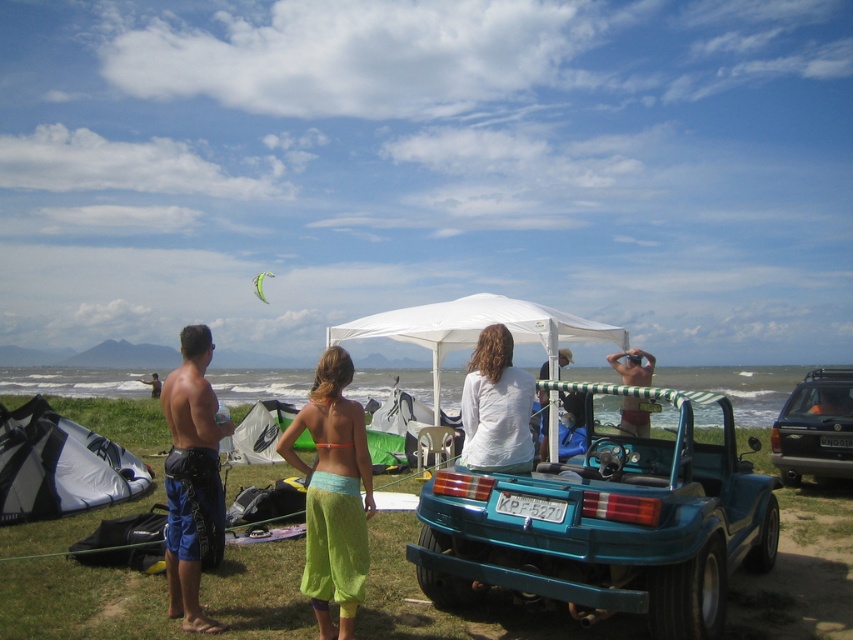
Question: Which point is closer to the camera taking this photo?

Choices:
 (A) (184, 570)
 (B) (787, 456)
 (C) (627, 596)

Answer: (C)

Question: Which point is farther from the camera taking this photo?

Choices:
 (A) (360, 544)
 (B) (258, 291)
 (C) (809, 428)
 (D) (264, 410)

Answer: (B)

Question: Among these objects, which one is farthest from the camera?

Choices:
 (A) white matte tent at center
 (B) smooth skin man at center
 (C) white matte shirt at center

Answer: (B)

Question: Can you confirm if blue fabric shorts at left is wider than white fabric kite at lower left?

Choices:
 (A) no
 (B) yes

Answer: (B)

Question: Is blue fabric shorts at left behind white matte tent at center?

Choices:
 (A) yes
 (B) no

Answer: (A)

Question: Is white fabric kite at lower left wider than smooth skin man at center?

Choices:
 (A) no
 (B) yes

Answer: (A)